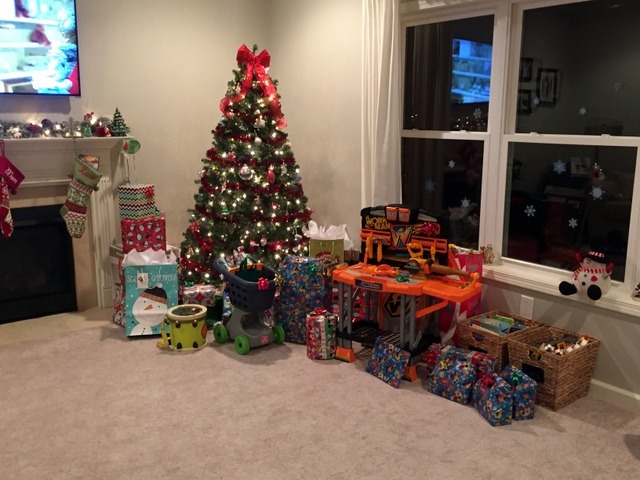
Locate an element on the screen. The image size is (640, 480). beige carpet is located at coordinates (145, 424).